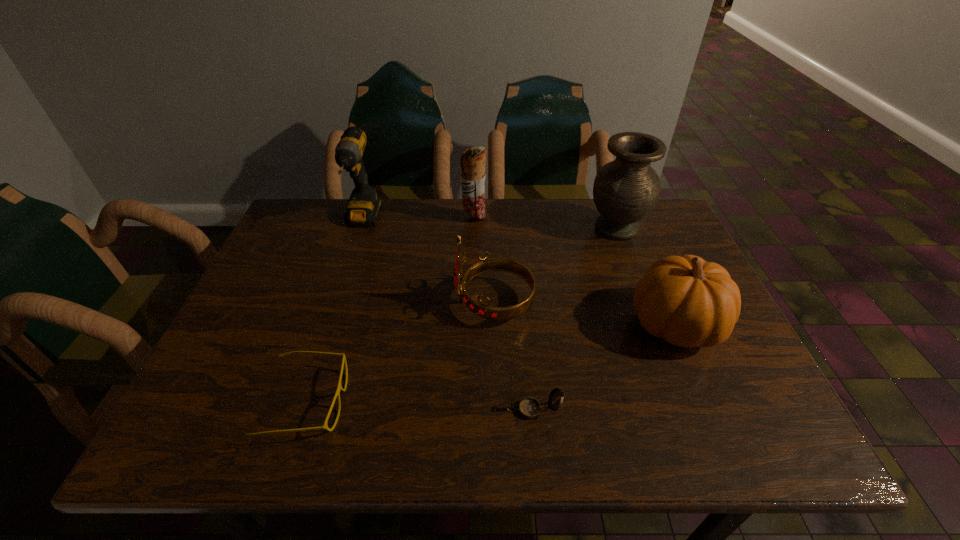
Find the location of a particular element. This screenshot has height=540, width=960. burrito located in the far edge section of the desktop is located at coordinates (473, 160).

Identify the location of compass present at the near edge. (529, 408).

This screenshot has height=540, width=960. Find the location of `spectacles that is at the near edge`. spectacles that is at the near edge is located at coordinates (339, 388).

The height and width of the screenshot is (540, 960). Identify the location of object that is at the left edge. (339, 388).

The height and width of the screenshot is (540, 960). I want to click on vase at the right edge, so click(x=625, y=190).

This screenshot has height=540, width=960. What are the coordinates of `pumpkin present at the right edge` in the screenshot? It's located at (688, 302).

Identify the location of object at the near left corner. (339, 388).

Where is `object that is at the far right corner`? Image resolution: width=960 pixels, height=540 pixels. object that is at the far right corner is located at coordinates (625, 190).

Identify the location of vacant region at the far edge of the desktop. (567, 199).

What are the coordinates of `free space at the near edge` in the screenshot? It's located at pyautogui.click(x=390, y=424).